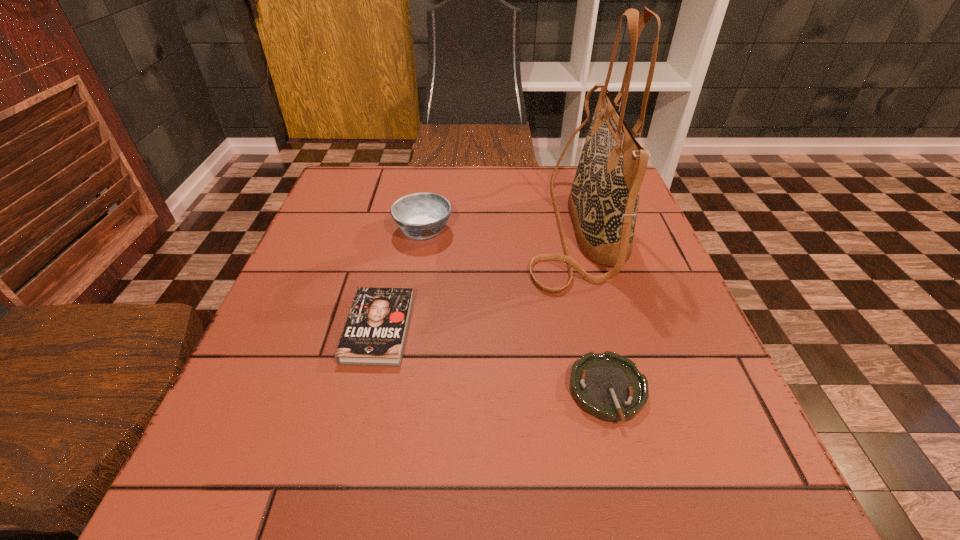
Locate an element on the screen. The image size is (960, 540). the tallest object is located at coordinates (603, 202).

This screenshot has width=960, height=540. Identify the location of the farther ashtray. (421, 215).

Find the location of a particular element. This screenshot has height=540, width=960. the left ashtray is located at coordinates (421, 215).

You are a GUI agent. You are given a task and a screenshot of the screen. Output one action in this format:
    pyautogui.click(x=<x>, y=<y>)
    Task: Click on the book
    The width and height of the screenshot is (960, 540).
    Given the screenshot: What is the action you would take?
    pyautogui.click(x=375, y=332)

Where is `the shorter ashtray`? The height and width of the screenshot is (540, 960). the shorter ashtray is located at coordinates (608, 386).

At what (x,y) coordinates should I click in order to perform the action: click on the right ashtray. Please return your answer as a coordinate pair (x, y). Image resolution: width=960 pixels, height=540 pixels. Looking at the image, I should click on (608, 386).

Locate an element on the screen. The height and width of the screenshot is (540, 960). free location located 0.350m on the front-facing side of the handbag is located at coordinates (376, 226).

Locate an element on the screen. The image size is (960, 540). free space located 0.120m on the front-facing side of the handbag is located at coordinates (472, 226).

Locate an element on the screen. Image resolution: width=960 pixels, height=540 pixels. free space located 0.060m on the front-facing side of the handbag is located at coordinates (498, 226).

What are the coordinates of `free space located 0.100m on the front of the third shortest object` in the screenshot? It's located at (416, 279).